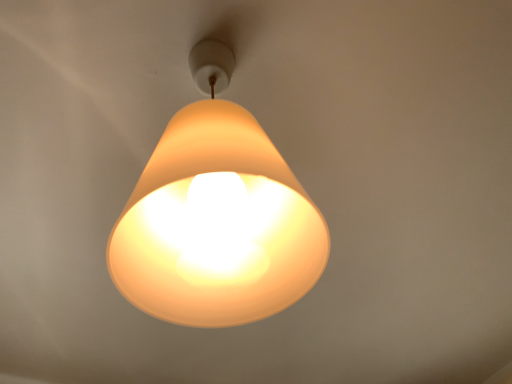
Image resolution: width=512 pixels, height=384 pixels. Describe the element at coordinates (216, 216) in the screenshot. I see `translucent orange lampshade at center` at that location.

Where is `translucent orange lampshade at center`? The image size is (512, 384). translucent orange lampshade at center is located at coordinates (216, 216).

This screenshot has height=384, width=512. What are the coordinates of `translucent orange lampshade at center` in the screenshot? It's located at (x=216, y=216).